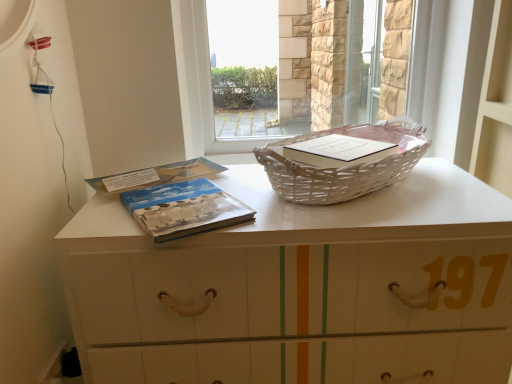
You are a GUI agent. You are given a task and a screenshot of the screen. Output one action in this format:
    pyautogui.click(x=<x>, y=<y>)
    Task: Click on the vacant space to the right of matte blue cover book at center, the first paperback book positioned from the front
    The width and height of the screenshot is (512, 384).
    Given the screenshot: What is the action you would take?
    pyautogui.click(x=282, y=207)